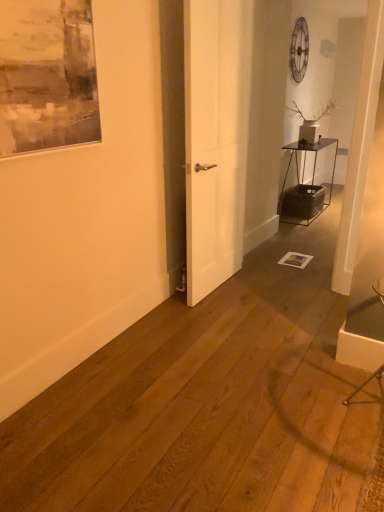
Question: Is point (223, 137) positioned closer to the camera than point (81, 139)?

Choices:
 (A) closer
 (B) farther

Answer: (B)

Question: Is white matte door at center in front of or behind matte gray painting at upper left in the image?

Choices:
 (A) front
 (B) behind

Answer: (B)

Question: Considering the real-world distances, which object is closest to the matte gray painting at upper left?

Choices:
 (A) white matte door at center
 (B) metallic black table at right
 (C) metallic silver armchair at lower right

Answer: (A)

Question: Based on their relative distances, which object is nearer to the metallic black table at right?

Choices:
 (A) metallic silver armchair at lower right
 (B) white matte door at center
 (C) matte gray painting at upper left

Answer: (B)